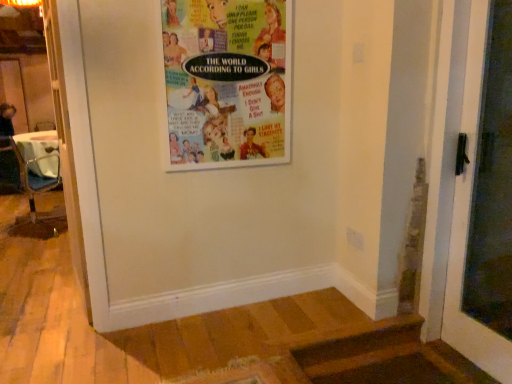
Question: From the image's perspective, does metallic silver chair at left appear lower than multicolored paper poster at upper center?

Choices:
 (A) no
 (B) yes

Answer: (B)

Question: Are metallic silver chair at left and multicolored paper poster at upper center far apart?

Choices:
 (A) no
 (B) yes

Answer: (B)

Question: From a real-world perspective, is metallic silver chair at left beneath multicolored paper poster at upper center?

Choices:
 (A) yes
 (B) no

Answer: (A)

Question: Does metallic silver chair at left have a greater height compared to multicolored paper poster at upper center?

Choices:
 (A) no
 (B) yes

Answer: (B)

Question: Is metallic silver chair at left behind multicolored paper poster at upper center?

Choices:
 (A) no
 (B) yes

Answer: (B)

Question: Considering the positions of white glossy door at right and metallic silver chair at left in the image, is white glossy door at right wider or thinner than metallic silver chair at left?

Choices:
 (A) thin
 (B) wide

Answer: (A)

Question: Looking at the image, does white glossy door at right seem bigger or smaller compared to metallic silver chair at left?

Choices:
 (A) big
 (B) small

Answer: (B)

Question: From the image's perspective, is white glossy door at right above or below metallic silver chair at left?

Choices:
 (A) below
 (B) above

Answer: (A)

Question: Is white glossy door at right situated inside metallic silver chair at left or outside?

Choices:
 (A) outside
 (B) inside

Answer: (A)

Question: Is multicolored paper poster at upper center taller or shorter than metallic silver chair at left?

Choices:
 (A) tall
 (B) short

Answer: (B)

Question: Would you say multicolored paper poster at upper center is inside or outside metallic silver chair at left?

Choices:
 (A) outside
 (B) inside

Answer: (A)

Question: Considering the positions of point (188, 134) and point (28, 135), is point (188, 134) closer or farther from the camera than point (28, 135)?

Choices:
 (A) farther
 (B) closer

Answer: (B)

Question: From a real-world perspective, relative to metallic silver chair at left, is multicolored paper poster at upper center vertically above or below?

Choices:
 (A) above
 (B) below

Answer: (A)

Question: In terms of height, does metallic silver chair at left look taller or shorter compared to white glossy door at right?

Choices:
 (A) short
 (B) tall

Answer: (A)

Question: Would you say metallic silver chair at left is inside or outside white glossy door at right?

Choices:
 (A) inside
 (B) outside

Answer: (B)